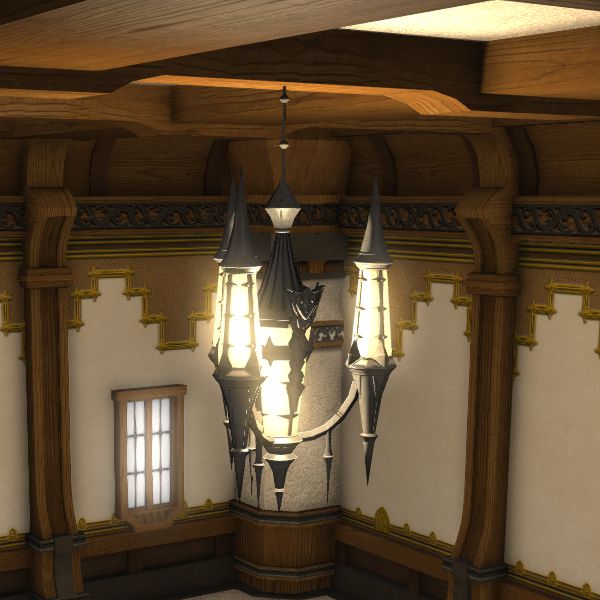
Locate an element on the screen. metal part of chandelier is located at coordinates (333, 421), (374, 406), (275, 462), (235, 392), (305, 307), (280, 275), (240, 237), (276, 192), (373, 235).